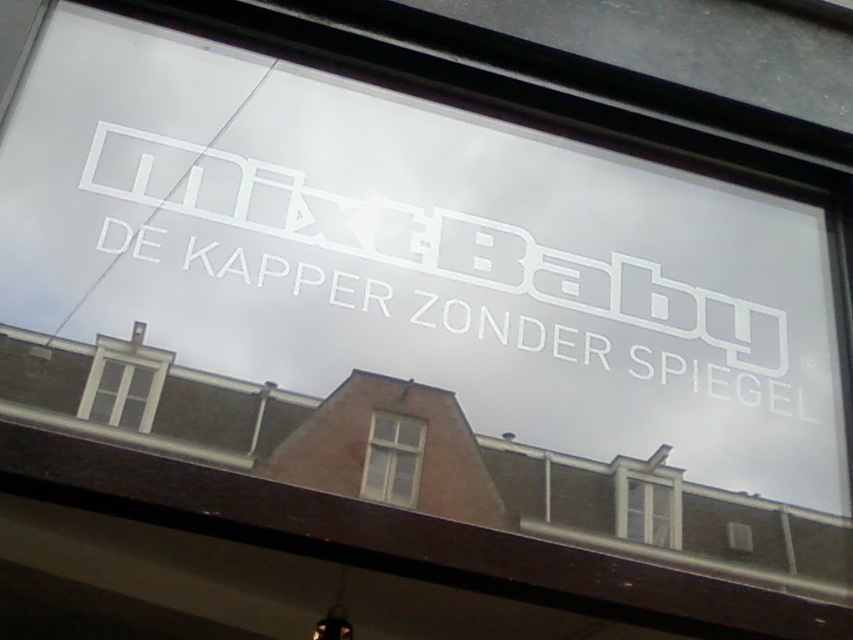
Looking at this image, you are standing in front of the storefront window and want to know if the white matte sign at center is taller than the white wooden window at center. Can you determine this based on the scene?

The white matte sign at center is much taller than the white wooden window at center, so yes, the white matte sign at center is taller.

You are standing in front of the storefront window. You notice two windows. The white wooden window at center and the clear glass window at center. Which one is positioned higher?

The white wooden window at center is located above the clear glass window at center, so it is positioned higher.

You are standing in front of the storefront window and want to place a small sticker exactly at the center of the white matte sign at center. According to the coordinates provided, where should you place the sticker?

The sticker should be placed at the coordinates point (440,248) on the white matte sign at center.